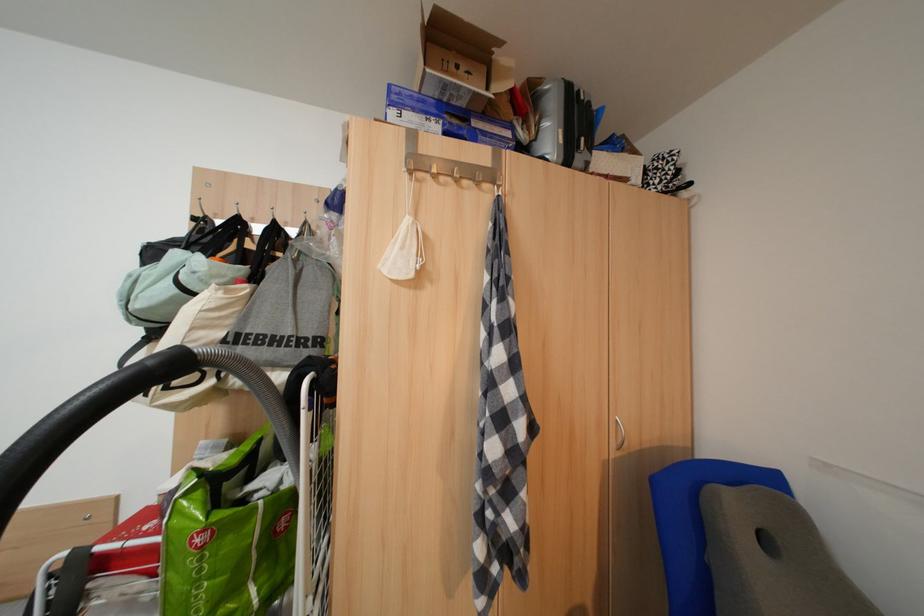
Locate an element on the screen. This screenshot has width=924, height=616. silver cabinet handle is located at coordinates (619, 434).